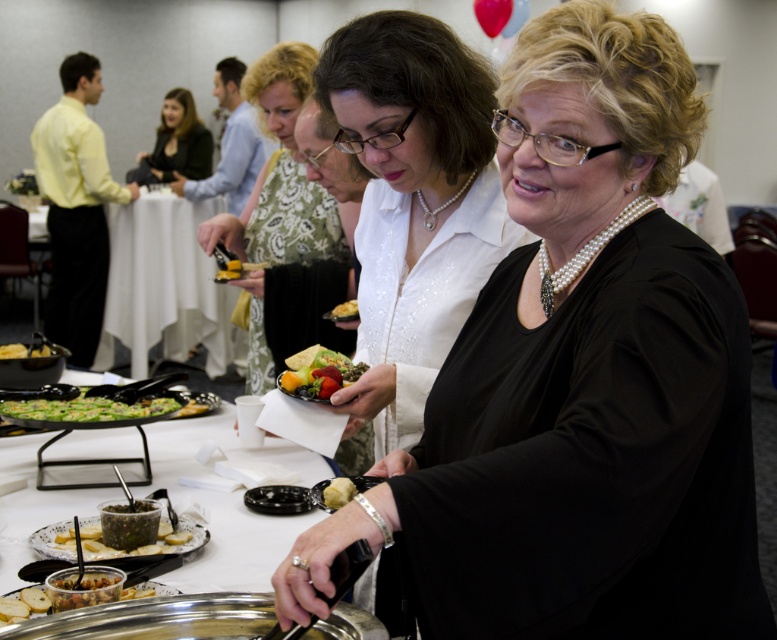
Question: Is the position of pearl necklace at center less distant than that of black plastic tray at lower left?

Choices:
 (A) yes
 (B) no

Answer: (A)

Question: Which object is farther from the camera taking this photo?

Choices:
 (A) white satin blouse at center
 (B) pearl necklace at center
 (C) smooth white plate at lower center

Answer: (A)

Question: Can you confirm if metallic silver platter at center is smaller than green matte platter at lower left?

Choices:
 (A) no
 (B) yes

Answer: (A)

Question: Can you confirm if matte black dress at center is thinner than green matte vegetable roll at lower left?

Choices:
 (A) yes
 (B) no

Answer: (B)

Question: Which object appears farthest from the camera in this image?

Choices:
 (A) shiny metallic bowl at lower left
 (B) black plastic tray at lower left
 (C) pearl necklace at center
 (D) smooth white plate at lower center

Answer: (B)

Question: Which of these objects is positioned closest to the green matte platter at lower left?

Choices:
 (A) metallic silver platter at center
 (B) matte black dress at center

Answer: (A)